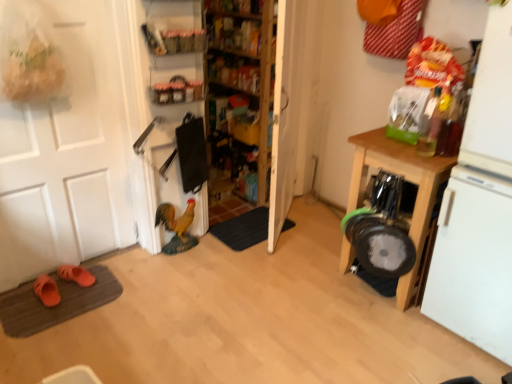
The width and height of the screenshot is (512, 384). Find the location of `free location to the right of wooden shelves at center, which is the third shelf from front to back`. free location to the right of wooden shelves at center, which is the third shelf from front to back is located at coordinates (313, 221).